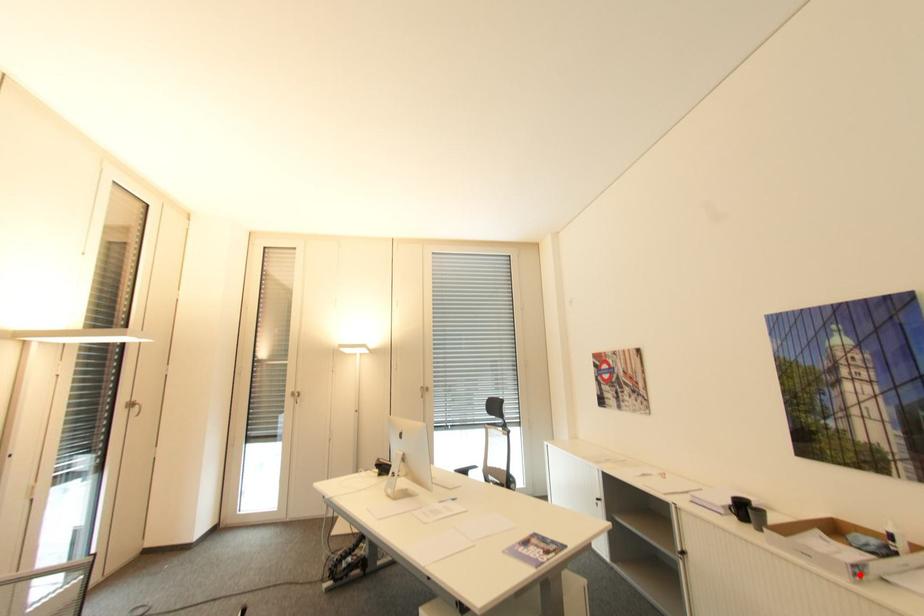
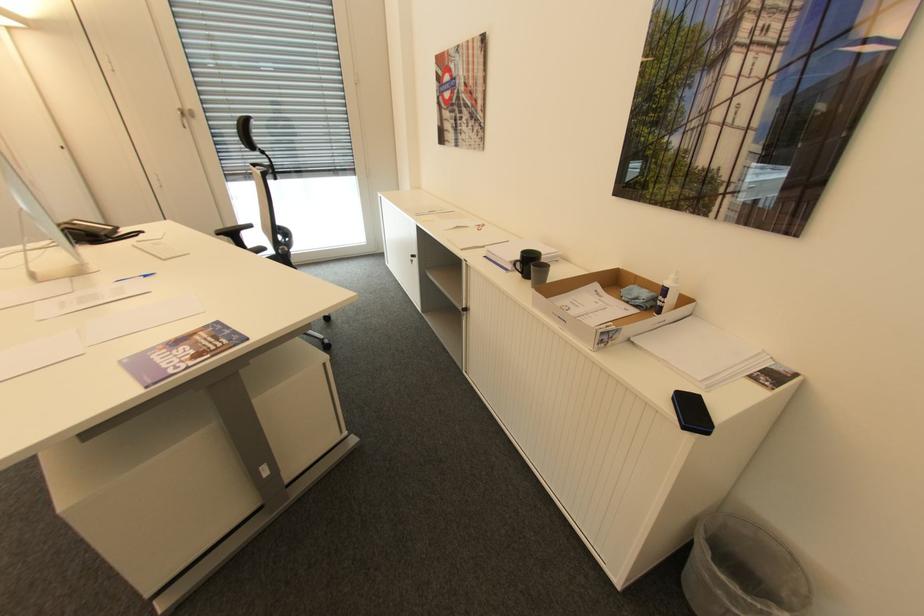
Question: I am providing you with two images of the same scene from different viewpoints. In image1, a red point is highlighted. Considering the same 3D point in image2, which of the following is correct?

Choices:
 (A) It is closer
 (B) It is farther

Answer: (B)